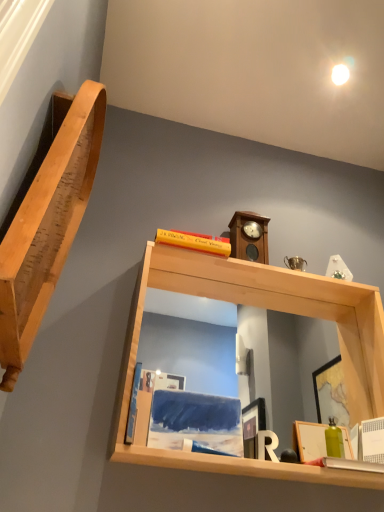
Question: Considering the positions of blue matte book at lower left and light wood/matte mirror at upper center, arranged as the first shelf when viewed from the right, in the image, is blue matte book at lower left taller or shorter than light wood/matte mirror at upper center, arranged as the first shelf when viewed from the right,?

Choices:
 (A) short
 (B) tall

Answer: (A)

Question: Choose the correct answer: Is blue matte book at lower left inside light wood/matte mirror at upper center, arranged as the first shelf when viewed from the right, or outside it?

Choices:
 (A) outside
 (B) inside

Answer: (B)

Question: Estimate the real-world distances between objects in this image. Which object is farther from the wooden clock at upper center?

Choices:
 (A) natural wood shelf at left, placed as the 2th shelf when sorted from right to left
 (B) matte wooden picture frame at lower right
 (C) light wood/matte mirror at upper center, the second shelf from the left
 (D) blue matte book at lower left

Answer: (A)

Question: Which object is the closest to the natural wood shelf at left, placed as the 2th shelf when sorted from right to left?

Choices:
 (A) blue matte book at lower left
 (B) wooden clock at upper center
 (C) matte wooden picture frame at lower right
 (D) light wood/matte mirror at upper center, the second shelf from the left

Answer: (D)